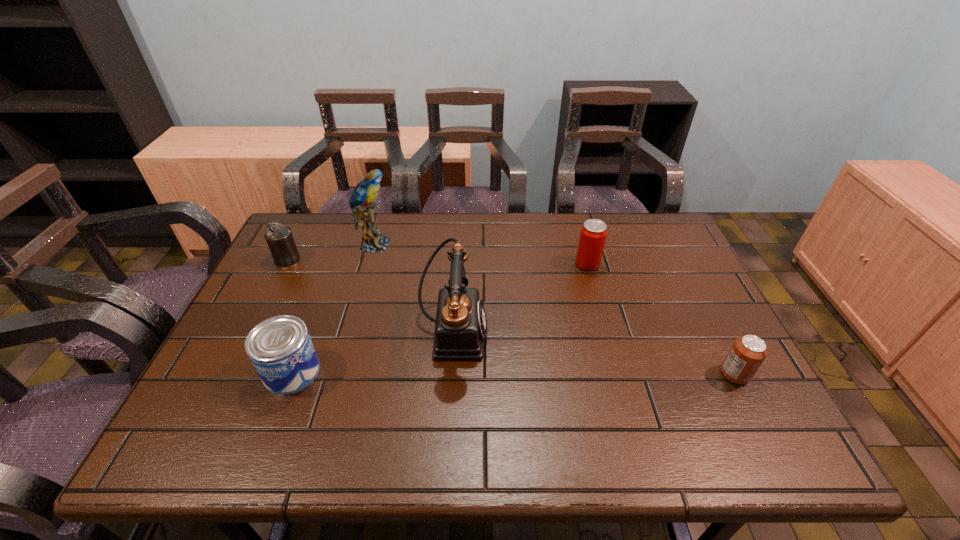
Identify the location of free space located on the right of the leftmost can. (404, 259).

At what (x,y) coordinates should I click in order to perform the action: click on vacant space positioned 0.060m on the front label of the second can from left to right. Please return your answer as a coordinate pair (x, y). The height and width of the screenshot is (540, 960). Looking at the image, I should click on (345, 372).

Where is `blank space located on the left of the rightmost object`? This screenshot has width=960, height=540. blank space located on the left of the rightmost object is located at coordinates (567, 374).

At what (x,y) coordinates should I click in order to perform the action: click on parrot located in the far edge section of the desktop. Please return your answer as a coordinate pair (x, y). The width and height of the screenshot is (960, 540). Looking at the image, I should click on (366, 190).

The image size is (960, 540). What are the coordinates of `object that is at the right edge` in the screenshot? It's located at (748, 352).

Find the location of a particular element. The height and width of the screenshot is (540, 960). object that is at the far left corner is located at coordinates (279, 238).

Locate an element on the screen. The image size is (960, 540). free spot at the far edge of the desktop is located at coordinates (540, 241).

Locate an element on the screen. The height and width of the screenshot is (540, 960). vacant position at the near edge of the desktop is located at coordinates (287, 436).

Identify the location of free spot at the left edge of the desktop. This screenshot has height=540, width=960. (242, 318).

Locate an element on the screen. The height and width of the screenshot is (540, 960). free space at the right edge of the desktop is located at coordinates (660, 303).